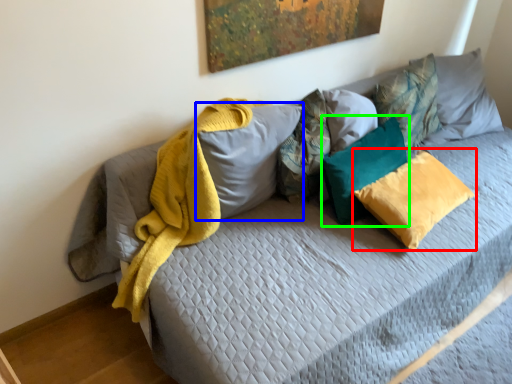
Question: Which object is positioned farthest from pillow (highlighted by a red box)? Select from pillow (highlighted by a blue box) and pillow (highlighted by a green box).

Choices:
 (A) pillow
 (B) pillow

Answer: (A)